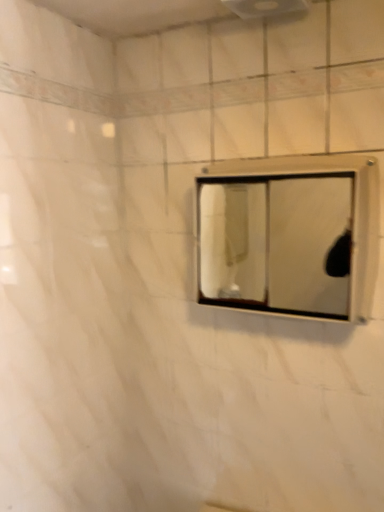
The width and height of the screenshot is (384, 512). Identify the location of metallic silver mirror at center. (274, 243).

Image resolution: width=384 pixels, height=512 pixels. Describe the element at coordinates (274, 243) in the screenshot. I see `metallic silver mirror at center` at that location.

Identify the location of metallic silver mirror at center. Image resolution: width=384 pixels, height=512 pixels. (274, 243).